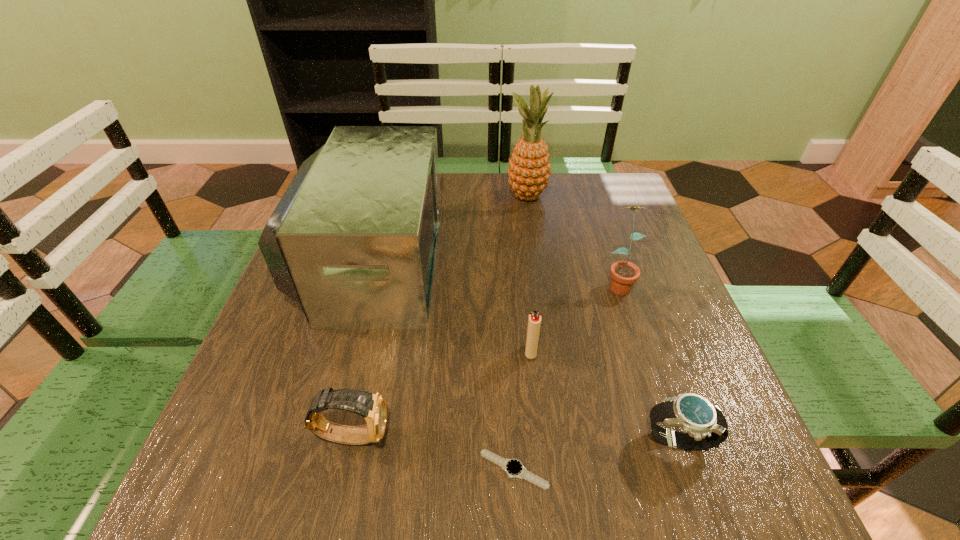
Identify which object is located as the second nearest to the rightmost watch. Please provide its 2D coordinates. Your answer should be formatted as a tuple, i.e. [(x, y)], where the tuple contains the x and y coordinates of a point satisfying the conditions above.

[(534, 321)]

Point out which watch is positioned as the third nearest to the sixth shortest object. Please provide its 2D coordinates. Your answer should be formatted as a tuple, i.e. [(x, y)], where the tuple contains the x and y coordinates of a point satisfying the conditions above.

[(704, 426)]

Identify the location of watch identified as the second closest to the second watch from right to left. (704, 426).

Where is `free space that satisfies the following two spatial constraints: 1. on the flower of the fifth shortest object; 2. on the face of the leftmost watch`? The width and height of the screenshot is (960, 540). free space that satisfies the following two spatial constraints: 1. on the flower of the fifth shortest object; 2. on the face of the leftmost watch is located at coordinates (668, 435).

Locate an element on the screen. vacant point that satisfies the following two spatial constraints: 1. on the back side of the shortest object; 2. on the left side of the rightmost watch is located at coordinates (513, 442).

The width and height of the screenshot is (960, 540). I want to click on free location that satisfies the following two spatial constraints: 1. on the face of the shortest object; 2. on the left side of the tallest watch, so click(x=345, y=469).

Locate an element on the screen. vacant point that satisfies the following two spatial constraints: 1. on the front-facing side of the second tallest object; 2. on the back side of the second watch from left to right is located at coordinates (314, 469).

Locate an element on the screen. This screenshot has width=960, height=540. vacant space that satisfies the following two spatial constraints: 1. on the back side of the pineapple; 2. on the right side of the shortest object is located at coordinates (498, 197).

I want to click on vacant space that satisfies the following two spatial constraints: 1. on the front-facing side of the second watch from right to left; 2. on the right side of the microwave oven, so click(314, 469).

This screenshot has width=960, height=540. Find the location of `free location that satisfies the following two spatial constraints: 1. on the front side of the igniter; 2. on the right side of the second shortest object`. free location that satisfies the following two spatial constraints: 1. on the front side of the igniter; 2. on the right side of the second shortest object is located at coordinates (540, 442).